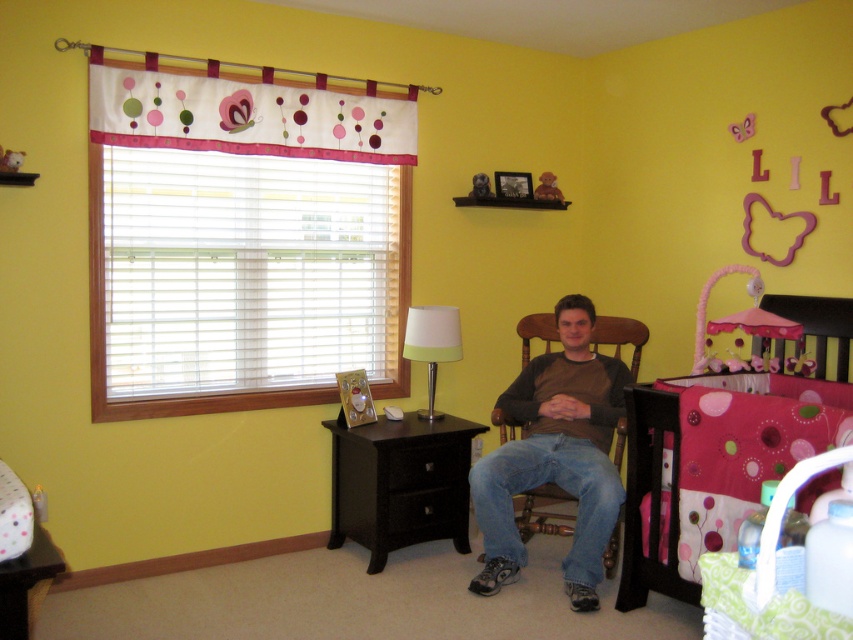
In the scene shown: Is black wood dresser at lower center shorter than white matte lamp at center?

No, black wood dresser at lower center is not shorter than white matte lamp at center.

Is point (363, 516) behind point (415, 340)?

No, it is not.

Who is more forward, (345, 506) or (418, 337)?

Point (418, 337) is more forward.

Locate an element on the screen. This screenshot has height=640, width=853. black wood dresser at lower center is located at coordinates (399, 483).

Who is more distant from viewer, (x=363, y=448) or (x=558, y=195)?

The point (x=558, y=195) is more distant.

Is black wood dresser at lower center wider than pink fabric teddy bear at upper center?

Yes, black wood dresser at lower center is wider than pink fabric teddy bear at upper center.

At what (x,y) coordinates should I click in order to perform the action: click on black wood dresser at lower center. Please return your answer as a coordinate pair (x, y). Image resolution: width=853 pixels, height=640 pixels. Looking at the image, I should click on (399, 483).

At what (x,y) coordinates should I click in order to perform the action: click on black wood dresser at lower center. Please return your answer as a coordinate pair (x, y). Looking at the image, I should click on [x=399, y=483].

Can you confirm if white fabric curtain at upper left is bigger than black wood dresser at lower center?

Indeed, white fabric curtain at upper left has a larger size compared to black wood dresser at lower center.

Is point (215, 227) positioned before point (431, 509)?

Yes, point (215, 227) is in front of point (431, 509).

Where is `white fabric curtain at upper left`? This screenshot has height=640, width=853. white fabric curtain at upper left is located at coordinates pyautogui.click(x=242, y=237).